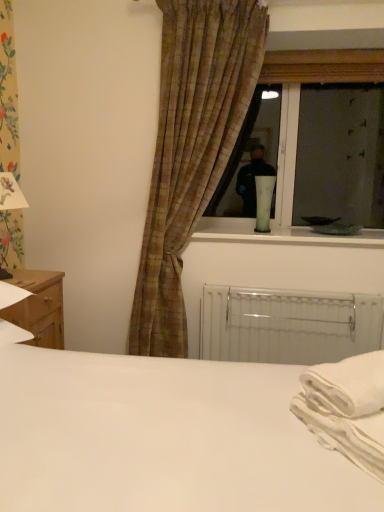
Describe the element at coordinates (191, 149) in the screenshot. This screenshot has width=384, height=512. I see `plaid fabric curtain at center` at that location.

At what (x,y) coordinates should I click in order to perform the action: click on green glass vase at window, which is counted as the second table lamp, starting from the left. Please return your answer as a coordinate pair (x, y). The width and height of the screenshot is (384, 512). Looking at the image, I should click on (264, 202).

The height and width of the screenshot is (512, 384). What do you see at coordinates (10, 193) in the screenshot?
I see `white paper lampshade at left, the 2th table lamp from the right` at bounding box center [10, 193].

Measure the distance between point (x=249, y=313) and camera.

Point (x=249, y=313) and camera are 7.12 feet apart.

Image resolution: width=384 pixels, height=512 pixels. In order to click on white cotton cloth at lower right in this screenshot , I will do `click(347, 408)`.

Image resolution: width=384 pixels, height=512 pixels. Describe the element at coordinates (162, 437) in the screenshot. I see `white matte bed at center` at that location.

Where is `wooden nightstand at lower left`? The width and height of the screenshot is (384, 512). wooden nightstand at lower left is located at coordinates (39, 307).

Does plaid fabric curtain at center have a larger size compared to wooden nightstand at lower left?

Yes, plaid fabric curtain at center is bigger than wooden nightstand at lower left.

Measure the distance between plaid fabric curtain at center and wooden nightstand at lower left.

plaid fabric curtain at center is 70.57 centimeters from wooden nightstand at lower left.

Who is more distant, plaid fabric curtain at center or wooden nightstand at lower left?

plaid fabric curtain at center is further from the camera.

Considering the relative sizes of plaid fabric curtain at center and wooden nightstand at lower left in the image provided, is plaid fabric curtain at center taller than wooden nightstand at lower left?

Yes.

Between plaid fabric curtain at center and white cotton cloth at lower right, which one has larger size?

With larger size is plaid fabric curtain at center.

From the image's perspective, between plaid fabric curtain at center and white cotton cloth at lower right, who is located below?

white cotton cloth at lower right is shown below in the image.

What are the coordinates of `cloth that is on the right side of plaid fabric curtain at center` in the screenshot? It's located at (347, 408).

From the picture: Which of these two, wooden nightstand at lower left or plaid fabric curtain at center, stands taller?

plaid fabric curtain at center is taller.

Which object is closer to the camera taking this photo, wooden nightstand at lower left or plaid fabric curtain at center?

wooden nightstand at lower left is more forward.

From the image's perspective, is wooden nightstand at lower left over plaid fabric curtain at center?

No.

Who is bigger, wooden nightstand at lower left or plaid fabric curtain at center?

plaid fabric curtain at center.

Is the surface of white metallic radiator at lower center in direct contact with wooden nightstand at lower left?

No.

From a real-world perspective, is white metallic radiator at lower center above or below wooden nightstand at lower left?

white metallic radiator at lower center is situated lower than wooden nightstand at lower left in the real world.

From their relative heights in the image, would you say white metallic radiator at lower center is taller or shorter than wooden nightstand at lower left?

In the image, white metallic radiator at lower center appears to be taller than wooden nightstand at lower left.

How different are the orientations of white metallic radiator at lower center and wooden nightstand at lower left in degrees?

90.6 degrees separate the facing orientations of white metallic radiator at lower center and wooden nightstand at lower left.

Is white paper lampshade at left, which ranks as the 2th table lamp in back-to-front order, wider or thinner than white metallic radiator at lower center?

In the image, white paper lampshade at left, which ranks as the 2th table lamp in back-to-front order, appears to be wider than white metallic radiator at lower center.

Between white paper lampshade at left, which appears as the 1th table lamp when viewed from the front, and white metallic radiator at lower center, which one has less height?

With less height is white metallic radiator at lower center.

Does white paper lampshade at left, the first table lamp viewed from the left, appear on the left side of white metallic radiator at lower center?

Yes.

Is point (4, 203) less distant than point (315, 306)?

Yes, point (4, 203) is closer to viewer.

Considering the sizes of objects white metallic radiator at lower center and green glass vase at window, which is the 2th table lamp in front-to-back order, in the image provided, who is bigger, white metallic radiator at lower center or green glass vase at window, which is the 2th table lamp in front-to-back order,?

Bigger between the two is white metallic radiator at lower center.

Is the surface of white metallic radiator at lower center in direct contact with green glass vase at window, which is counted as the second table lamp, starting from the left?

white metallic radiator at lower center and green glass vase at window, which is counted as the second table lamp, starting from the left, are clearly separated.

What's the angular difference between white metallic radiator at lower center and green glass vase at window, the 1th table lamp from the right,'s facing directions?

The angular difference between white metallic radiator at lower center and green glass vase at window, the 1th table lamp from the right, is 5.34 degrees.

Does point (381, 298) lie behind point (259, 217)?

No, (381, 298) is closer to viewer.

Is there a large distance between plaid fabric curtain at center and white matte bed at center?

plaid fabric curtain at center is positioned a significant distance from white matte bed at center.

Which object is thinner, plaid fabric curtain at center or white matte bed at center?

With smaller width is plaid fabric curtain at center.

From a real-world perspective, is plaid fabric curtain at center positioned above or below white matte bed at center?

Clearly, from a real-world perspective, plaid fabric curtain at center is above white matte bed at center.

This screenshot has width=384, height=512. In order to click on bed in front of the plaid fabric curtain at center in this screenshot , I will do `click(162, 437)`.

Where is `curtain on the right of wooden nightstand at lower left`? curtain on the right of wooden nightstand at lower left is located at coordinates (191, 149).

In order to click on curtain above the white cotton cloth at lower right (from the image's perspective) in this screenshot , I will do `click(191, 149)`.

When comparing their distances from white paper lampshade at left, which ranks as the 2th table lamp in back-to-front order, does plaid fabric curtain at center or white metallic radiator at lower center seem further?

white metallic radiator at lower center is further to white paper lampshade at left, which ranks as the 2th table lamp in back-to-front order.

Estimate the real-world distances between objects in this image. Which object is closer to white paper lampshade at left, which ranks as the 2th table lamp in back-to-front order, white matte bed at center or green glass vase at window, marked as the 1th table lamp in a back-to-front arrangement?

white matte bed at center is positioned closer to the anchor white paper lampshade at left, which ranks as the 2th table lamp in back-to-front order.

From the image, which object appears to be nearer to white cotton cloth at lower right, white matte bed at center or white paper lampshade at left, the 2th table lamp from the right?

The object closer to white cotton cloth at lower right is white matte bed at center.

Estimate the real-world distances between objects in this image. Which object is further from white metallic radiator at lower center, plaid fabric curtain at center or white paper lampshade at left, the 2th table lamp from the right?

Based on the image, white paper lampshade at left, the 2th table lamp from the right, appears to be further to white metallic radiator at lower center.

Which object lies nearer to the anchor point green glass vase at window, marked as the 1th table lamp in a back-to-front arrangement, wooden nightstand at lower left or white paper lampshade at left, which ranks as the 2th table lamp in back-to-front order?

wooden nightstand at lower left is positioned closer to the anchor green glass vase at window, marked as the 1th table lamp in a back-to-front arrangement.

When comparing their distances from plaid fabric curtain at center, does green glass vase at window, which is counted as the second table lamp, starting from the left, or white matte bed at center seem closer?

The object closer to plaid fabric curtain at center is green glass vase at window, which is counted as the second table lamp, starting from the left.

Which object lies further to the anchor point wooden nightstand at lower left, plaid fabric curtain at center or white paper lampshade at left, which ranks as the 2th table lamp in back-to-front order?

plaid fabric curtain at center is positioned further to the anchor wooden nightstand at lower left.

Based on their spatial positions, is white paper lampshade at left, the first table lamp viewed from the left, or green glass vase at window, which is the 2th table lamp in front-to-back order, closer to white matte bed at center?

The object closer to white matte bed at center is white paper lampshade at left, the first table lamp viewed from the left.

Find the location of `cloth between white matte bed at center and green glass vase at window, marked as the 1th table lamp in a back-to-front arrangement, along the z-axis`. cloth between white matte bed at center and green glass vase at window, marked as the 1th table lamp in a back-to-front arrangement, along the z-axis is located at coordinates (347, 408).

Find the location of a particular element. cloth between wooden nightstand at lower left and white metallic radiator at lower center from left to right is located at coordinates (347, 408).

Where is `cloth between white matte bed at center and white paper lampshade at left, the first table lamp viewed from the left, from front to back`? cloth between white matte bed at center and white paper lampshade at left, the first table lamp viewed from the left, from front to back is located at coordinates (347, 408).

The width and height of the screenshot is (384, 512). I want to click on curtain between white paper lampshade at left, the first table lamp viewed from the left, and green glass vase at window, the 1th table lamp from the right, in the horizontal direction, so click(x=191, y=149).